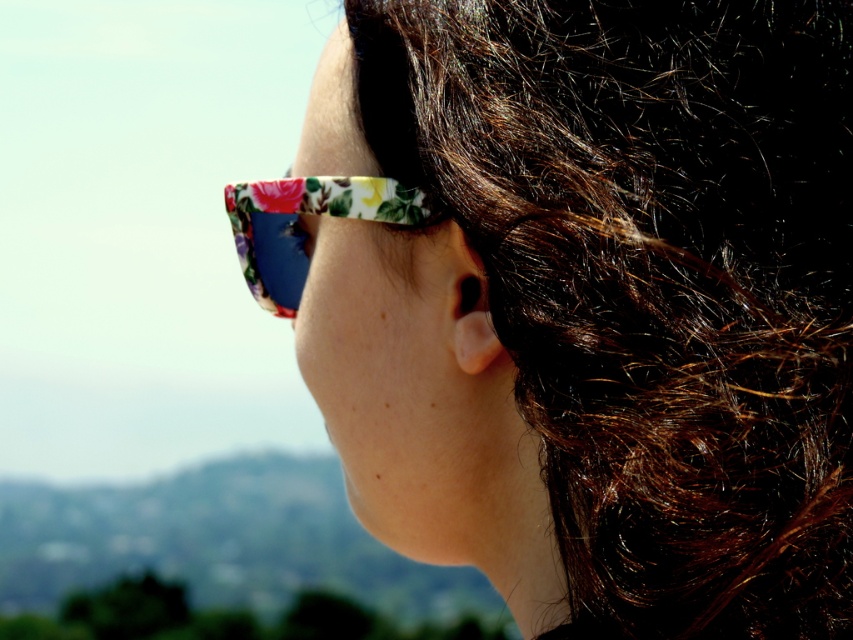
Between floral acetate sunglasses at center and floral-patterned plastic sunglasses at center, which one appears on the left side from the viewer's perspective?

floral-patterned plastic sunglasses at center

What do you see at coordinates (610, 305) in the screenshot?
I see `floral acetate sunglasses at center` at bounding box center [610, 305].

Measure the distance between point (720, 573) and camera.

Point (720, 573) and camera are 25.58 inches apart.

Where is `floral acetate sunglasses at center`? The width and height of the screenshot is (853, 640). floral acetate sunglasses at center is located at coordinates (610, 305).